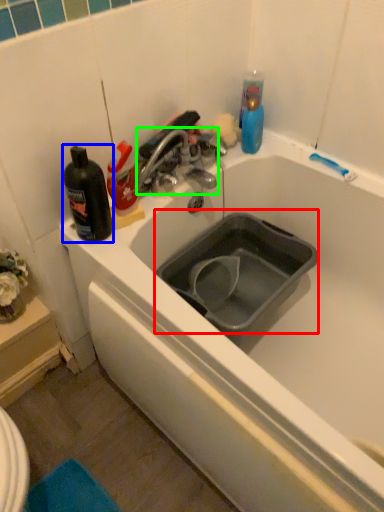
Question: Considering the real-world distances, which object is closest to sink (highlighted by a red box)? bottle (highlighted by a blue box) or tap (highlighted by a green box).

Choices:
 (A) bottle
 (B) tap

Answer: (B)